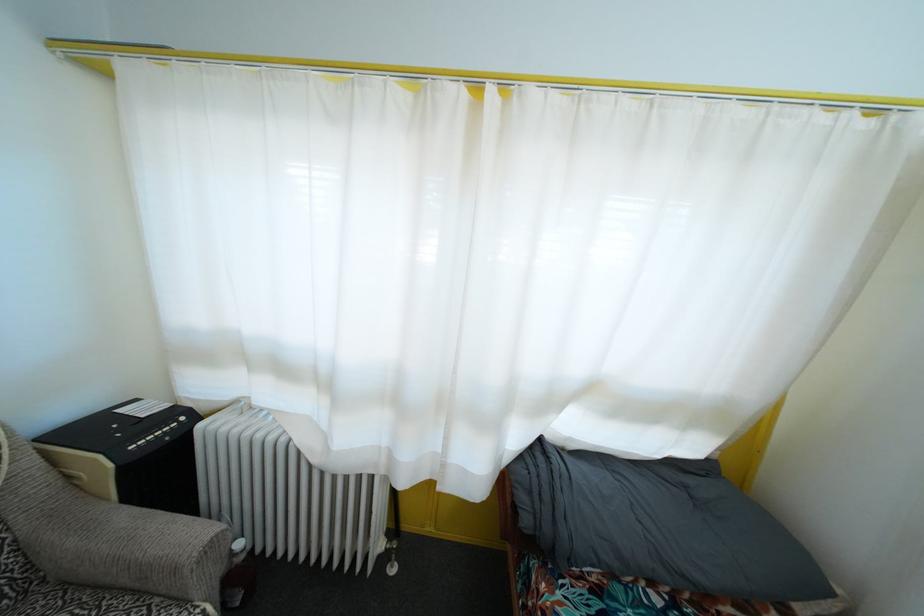
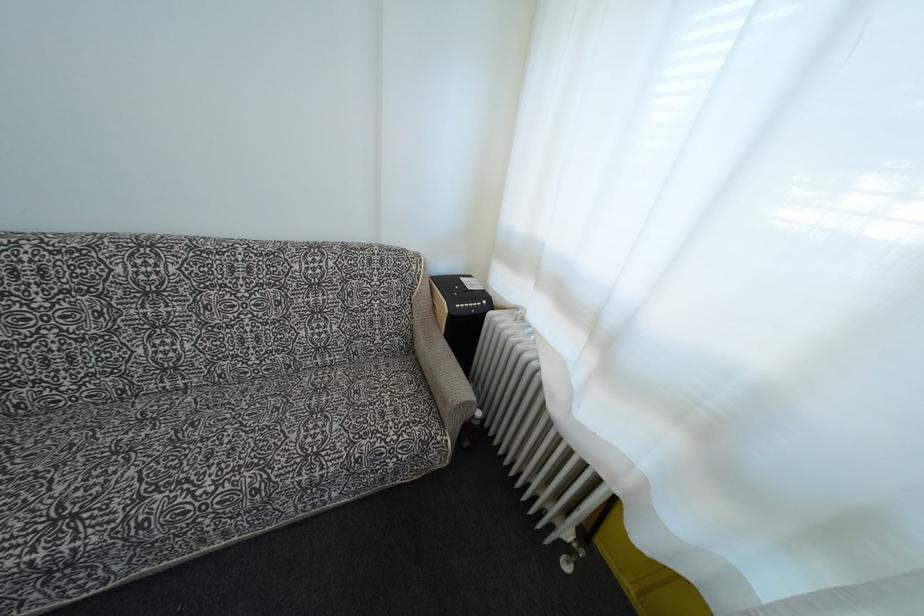
How did the camera likely rotate?

The rotation direction of the camera is left-down.